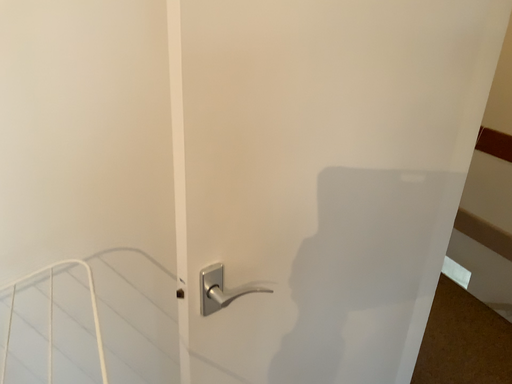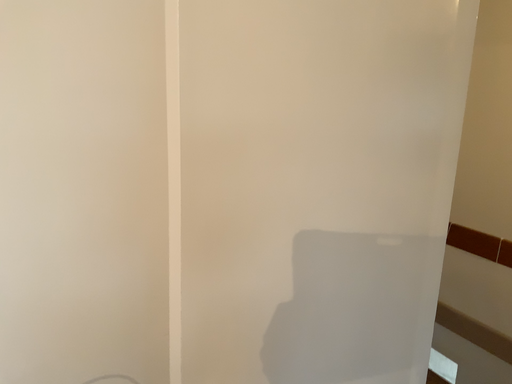
Question: How did the camera likely rotate when shooting the video?

Choices:
 (A) rotated upward
 (B) rotated downward

Answer: (A)